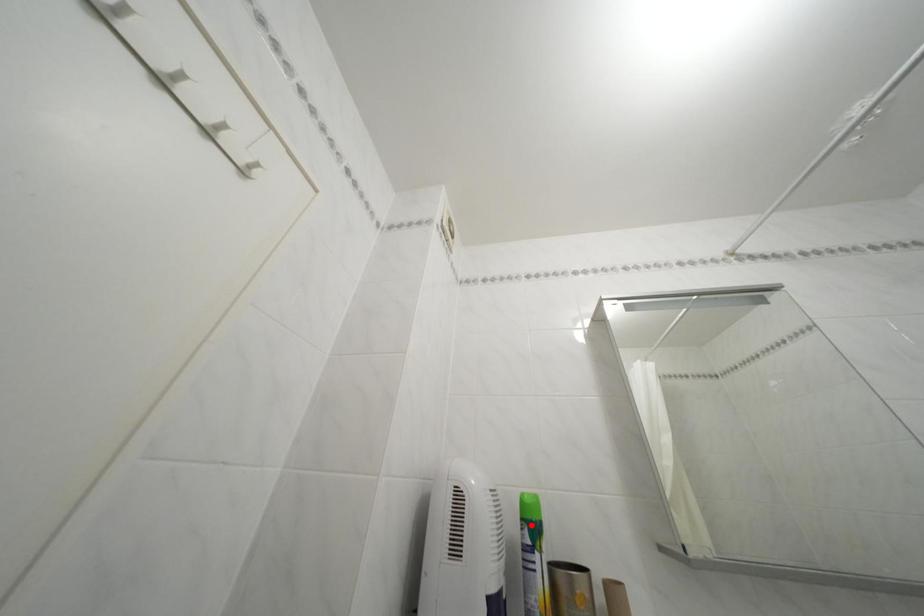
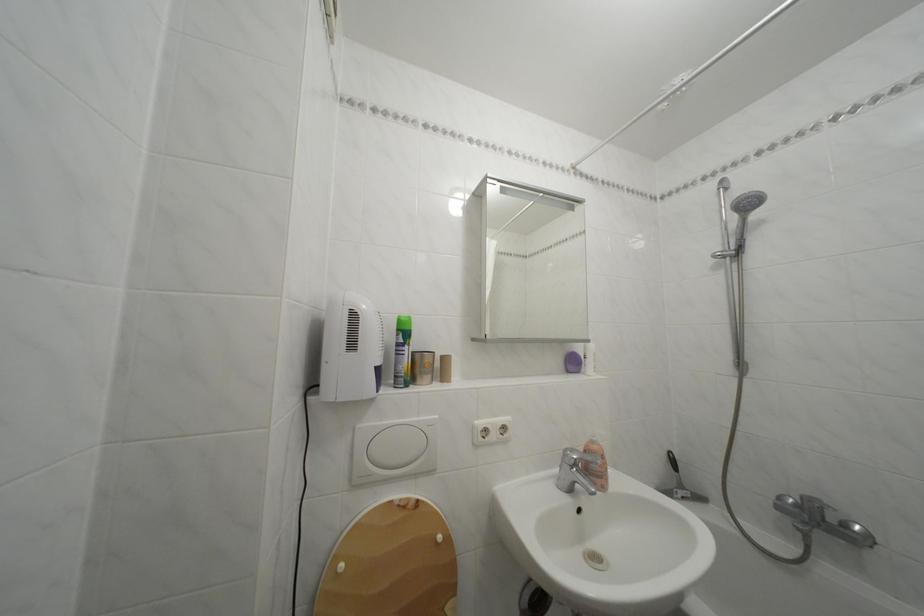
Where in the second image is the point corresponding to the highlighted location from the first image?

(407, 336)